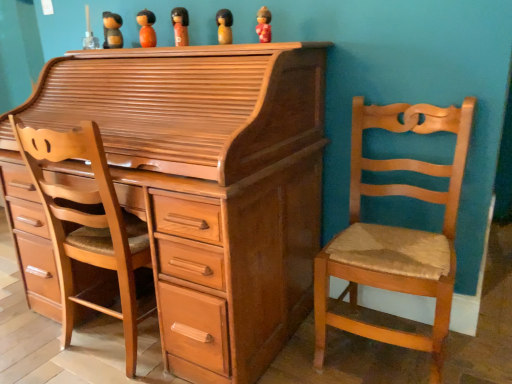
Question: Which direction should I rotate to face wooden figurine at upper center, arranged as the fourth toy when viewed from the left, — up or down?

Choices:
 (A) up
 (B) down

Answer: (A)

Question: Would you say matte red figurine at upper center, which ranks as the fifth toy in left-to-right order, is outside matte orange doll at center, placed as the third toy when sorted from right to left?

Choices:
 (A) yes
 (B) no

Answer: (A)

Question: Is matte red figurine at upper center, acting as the 1th toy starting from the right, positioned with its back to matte orange doll at center, the 3th toy from the left?

Choices:
 (A) no
 (B) yes

Answer: (A)

Question: Does matte red figurine at upper center, acting as the 1th toy starting from the right, come in front of matte orange doll at center, the 3th toy from the left?

Choices:
 (A) no
 (B) yes

Answer: (B)

Question: Is matte red figurine at upper center, acting as the 1th toy starting from the right, in contact with matte orange doll at center, placed as the third toy when sorted from right to left?

Choices:
 (A) yes
 (B) no

Answer: (B)

Question: Can matte orange doll at center, the 3th toy from the left, be found inside matte red figurine at upper center, acting as the 1th toy starting from the right?

Choices:
 (A) no
 (B) yes

Answer: (A)

Question: From a real-world perspective, does matte red figurine at upper center, which ranks as the fifth toy in left-to-right order, stand above matte orange doll at center, placed as the third toy when sorted from right to left?

Choices:
 (A) no
 (B) yes

Answer: (A)

Question: Is light brown wood swivel chair at left taller than matte red figurine at upper center, which ranks as the fifth toy in left-to-right order?

Choices:
 (A) yes
 (B) no

Answer: (A)

Question: Would you consider light brown wood swivel chair at left to be distant from matte red figurine at upper center, acting as the 1th toy starting from the right?

Choices:
 (A) no
 (B) yes

Answer: (A)

Question: Considering the relative sizes of light brown wood swivel chair at left and matte red figurine at upper center, which ranks as the fifth toy in left-to-right order, in the image provided, is light brown wood swivel chair at left smaller than matte red figurine at upper center, which ranks as the fifth toy in left-to-right order,?

Choices:
 (A) no
 (B) yes

Answer: (A)

Question: From the image's perspective, is light brown wood swivel chair at left on matte red figurine at upper center, which ranks as the fifth toy in left-to-right order?

Choices:
 (A) no
 (B) yes

Answer: (A)

Question: From a real-world perspective, is light brown wood swivel chair at left on top of matte red figurine at upper center, acting as the 1th toy starting from the right?

Choices:
 (A) yes
 (B) no

Answer: (B)

Question: Can you confirm if light brown wood swivel chair at left is bigger than matte red figurine at upper center, which ranks as the fifth toy in left-to-right order?

Choices:
 (A) no
 (B) yes

Answer: (B)

Question: Is light brown wood swivel chair at left bigger than matte orange doll at center, the 3th toy from the left?

Choices:
 (A) no
 (B) yes

Answer: (B)